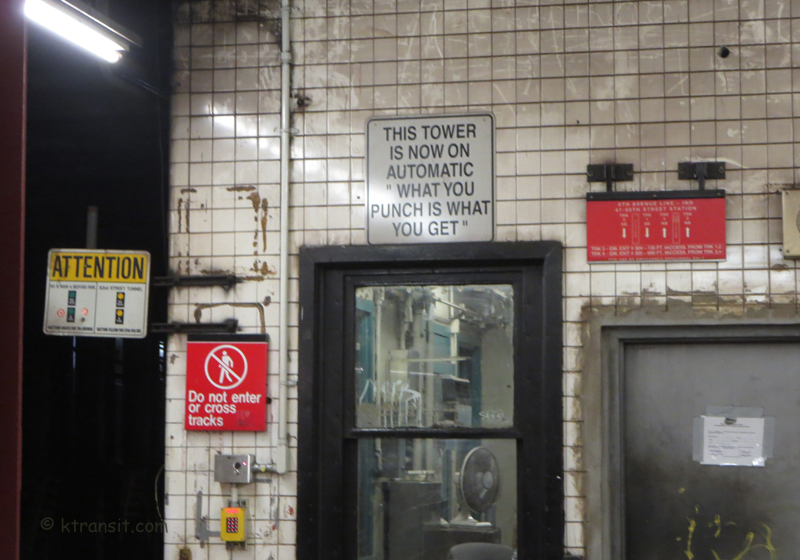
I want to click on tile wall, so click(565, 108).